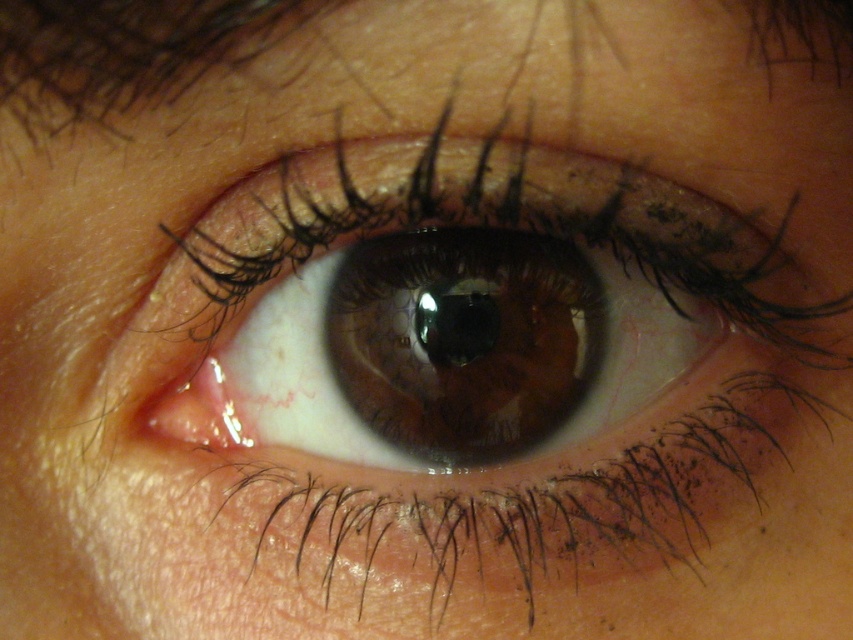
Does brown glossy eye at center have a lesser width compared to brown hair at upper left?

Incorrect, brown glossy eye at center's width is not less than brown hair at upper left's.

Who is more forward, (483, 541) or (50, 6)?

Point (50, 6) is in front.

Which is behind, point (473, 577) or point (173, 54)?

The point (473, 577) is more distant.

I want to click on brown glossy eye at center, so click(509, 465).